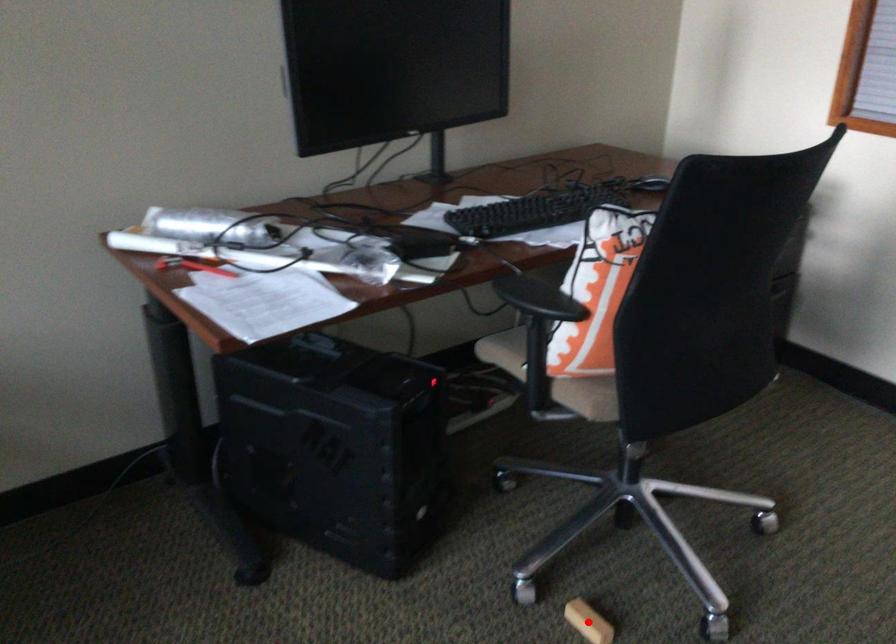
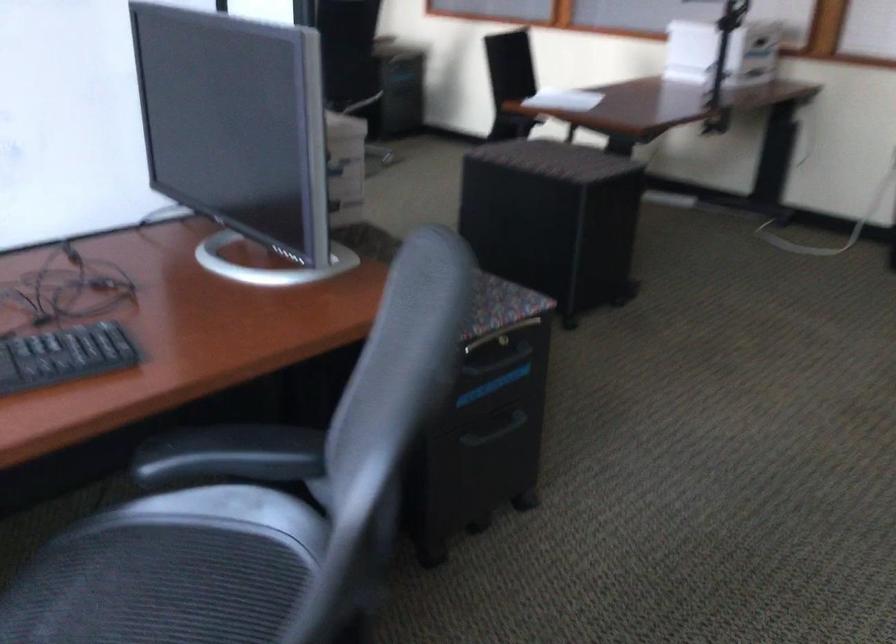
Question: I am providing you with two images of the same scene from different viewpoints. A red point is marked on the first image. At the location where the point appears in image 1, is it still visible in image 2?

Choices:
 (A) Yes
 (B) No

Answer: (B)